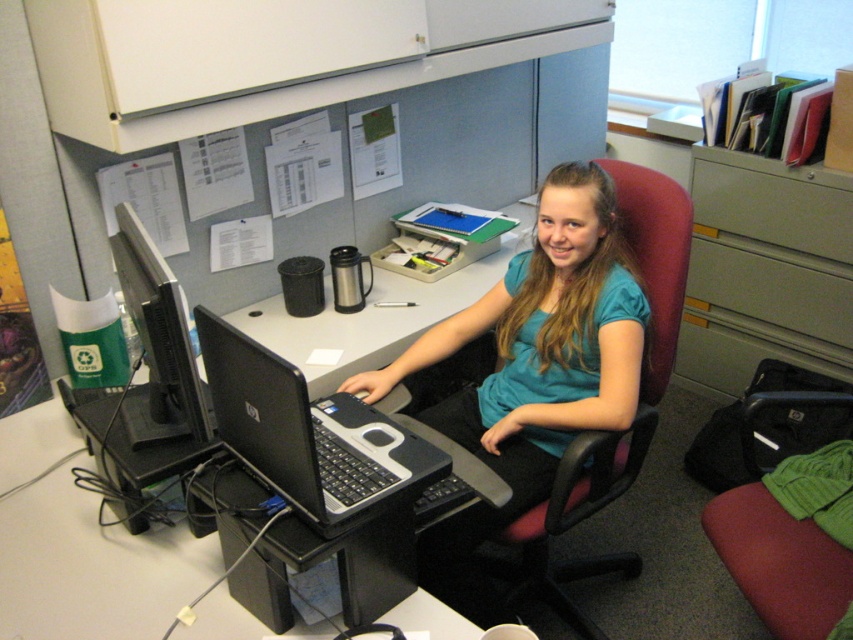
Based on the coordinates provided, what object is located at point (x=543, y=342) in the scene?

The point at (x=543, y=342) marks the teal fabric shirt at center.

You are standing in the office and want to place a small plant between the two points, point (722,198) and point (718,300). Which point should the plant be closer to so it is positioned in front of the other point?

The plant should be placed closer to point (722,198) because it is in front of point (718,300).

You are organizing a photoshoot and need to ensure that all items in the frame are appropriately sized. Given the scene described, which object between the teal fabric shirt at center and the black plastic computer desk at center should be adjusted in size to maintain a balanced composition?

The teal fabric shirt at center is smaller than the black plastic computer desk at center. To maintain a balanced composition, the teal fabric shirt at center should be enlarged or the desk reduced in size so both objects are more proportionate.